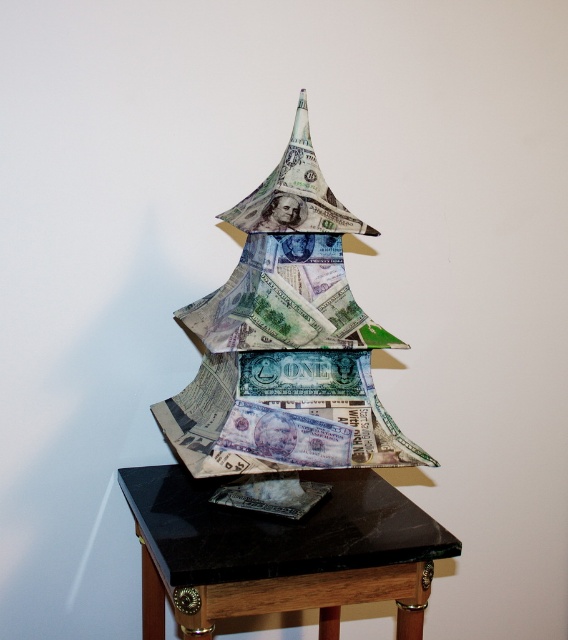
Question: Among these points, which one is nearest to the camera?

Choices:
 (A) (378, 440)
 (B) (157, 486)

Answer: (A)

Question: Is multi-colored paper money at center in front of black marble table at center?

Choices:
 (A) yes
 (B) no

Answer: (B)

Question: Can you confirm if multi-colored paper money at center is wider than black marble table at center?

Choices:
 (A) yes
 (B) no

Answer: (B)

Question: Is multi-colored paper money at center to the right of black marble table at center from the viewer's perspective?

Choices:
 (A) yes
 (B) no

Answer: (A)

Question: Among these objects, which one is farthest from the camera?

Choices:
 (A) black marble table at center
 (B) multi-colored paper money at center

Answer: (B)